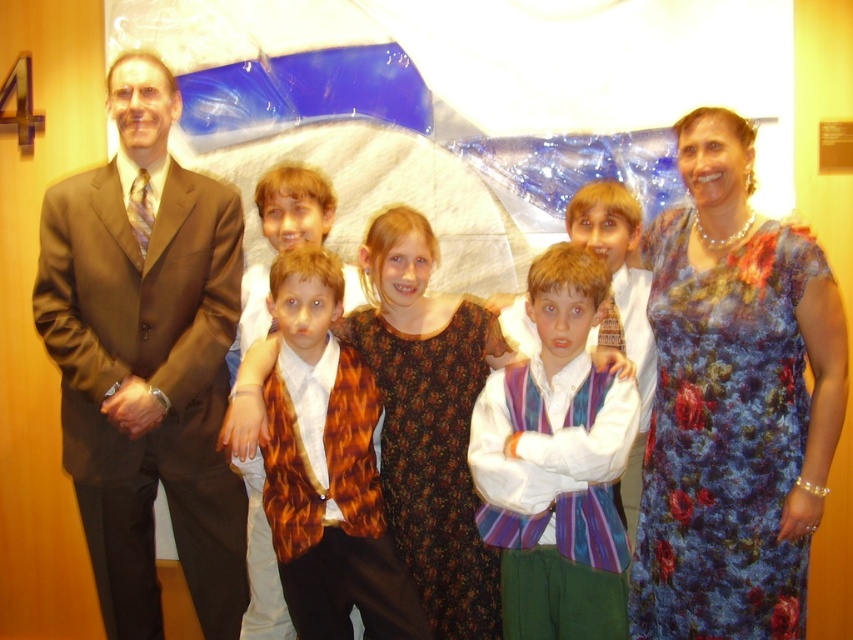
Image resolution: width=853 pixels, height=640 pixels. Describe the element at coordinates (556, 464) in the screenshot. I see `striped velvet vest at center` at that location.

Who is higher up, striped velvet vest at center or leopard print vest at center?

striped velvet vest at center is above.

Is point (550, 465) behind point (352, 456)?

No, it is not.

The image size is (853, 640). Identify the location of striped velvet vest at center. (556, 464).

Where is `brown suit at left`? brown suit at left is located at coordinates (146, 358).

Between point (178, 342) and point (352, 368), which one is positioned in front?

Positioned in front is point (352, 368).

Find the location of `brown suit at left`. brown suit at left is located at coordinates (146, 358).

Which is more to the left, floral silk dress at center or brown suit at left?

Positioned to the left is brown suit at left.

How far apart are floral silk dress at center and brown suit at left?

A distance of 1.31 meters exists between floral silk dress at center and brown suit at left.

Does point (845, 348) lie behind point (135, 534)?

No, it is in front of (135, 534).

You are a GUI agent. You are given a task and a screenshot of the screen. Output one action in this format:
    pyautogui.click(x=<x>, y=<y>)
    Task: Click on the floral silk dress at center
    This screenshot has width=853, height=640.
    Given the screenshot: What is the action you would take?
    pyautogui.click(x=733, y=403)